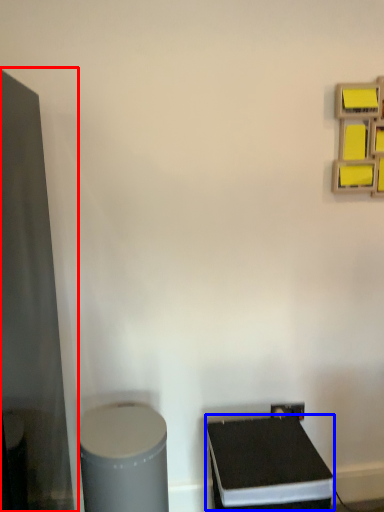
Question: Which object is further to the camera taking this photo, glass door (highlighted by a red box) or wide (highlighted by a blue box)?

Choices:
 (A) glass door
 (B) wide

Answer: (B)